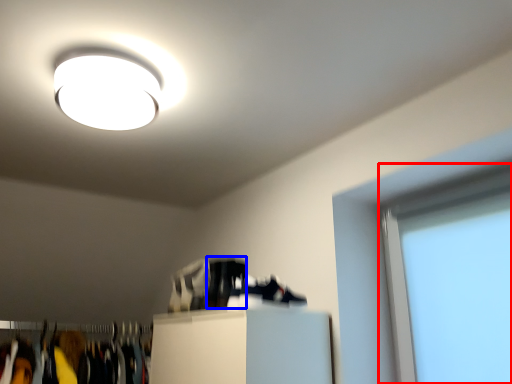
Question: Among these objects, which one is nearest to the camera, window screen (highlighted by a red box) or shoe (highlighted by a blue box)?

Choices:
 (A) window screen
 (B) shoe

Answer: (A)